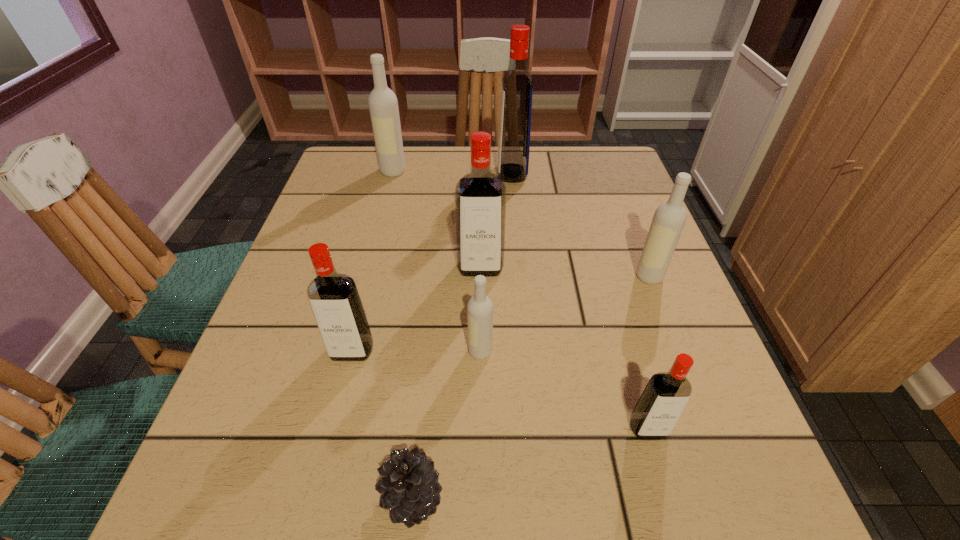
Locate an element on the screen. free space at the right edge of the desktop is located at coordinates (619, 267).

This screenshot has height=540, width=960. In order to click on vacant region between the third farthest red vodka and the leftmost white vodka in this screenshot , I will do `click(372, 261)`.

Identify the location of vacant space that's between the third nearest red vodka and the second smallest red vodka. (417, 309).

You are a GUI agent. You are given a task and a screenshot of the screen. Output one action in this format:
    pyautogui.click(x=<x>, y=<y>)
    Task: Click on the vacant area that lies between the third nearest red vodka and the rightmost red vodka
    
    Given the screenshot: What is the action you would take?
    pyautogui.click(x=564, y=348)

Image resolution: width=960 pixels, height=540 pixels. I want to click on empty space that is in between the rightmost object and the second white vodka from right to left, so click(564, 313).

The height and width of the screenshot is (540, 960). Find the location of `free space between the brown pinecone and the nearest vodka`. free space between the brown pinecone and the nearest vodka is located at coordinates (530, 463).

Locate an element on the screen. The width and height of the screenshot is (960, 540). vacant space that's between the farthest red vodka and the second vodka from right to left is located at coordinates (580, 300).

You are a GUI agent. You are given a task and a screenshot of the screen. Output one action in this format:
    pyautogui.click(x=<x>, y=<y>)
    Task: Click on the vacant area that lies between the third nearest red vodka and the smallest red vodka
    The width and height of the screenshot is (960, 540).
    Given the screenshot: What is the action you would take?
    pyautogui.click(x=564, y=348)

The width and height of the screenshot is (960, 540). In order to click on empty space between the biggest white vodka and the farthest red vodka in this screenshot , I will do `click(452, 172)`.

This screenshot has width=960, height=540. What are the coordinates of `vacant area that lies between the third object from left to right and the farthest white vodka` in the screenshot? It's located at (402, 334).